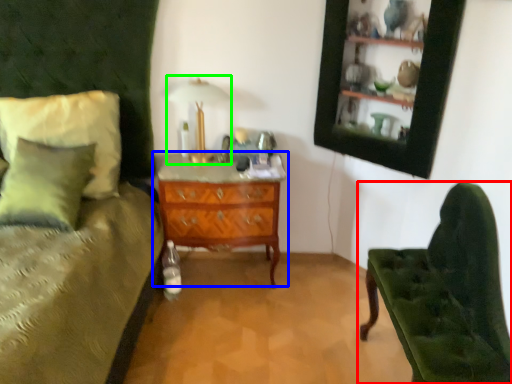
Question: Considering the real-world distances, which object is closest to chair (highlighted by a red box)? chest of drawers (highlighted by a blue box) or table lamp (highlighted by a green box).

Choices:
 (A) chest of drawers
 (B) table lamp

Answer: (A)